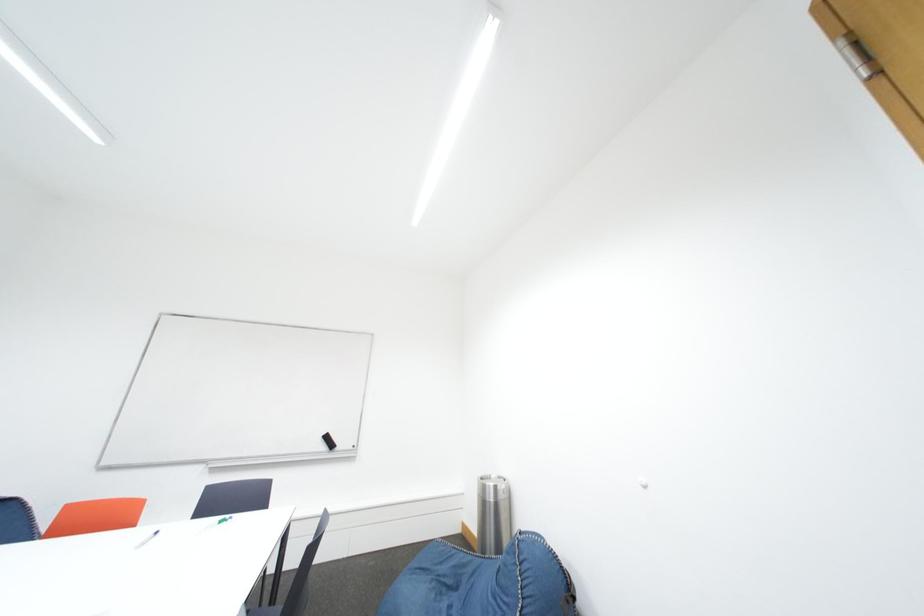
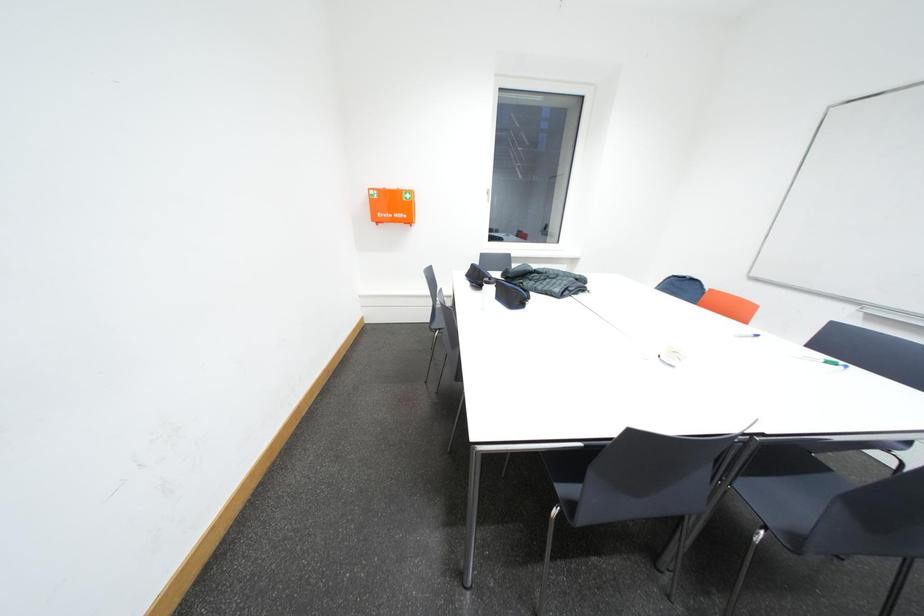
Question: How did the camera likely rotate?

Choices:
 (A) Left
 (B) Right
 (C) Up
 (D) Down

Answer: (A)